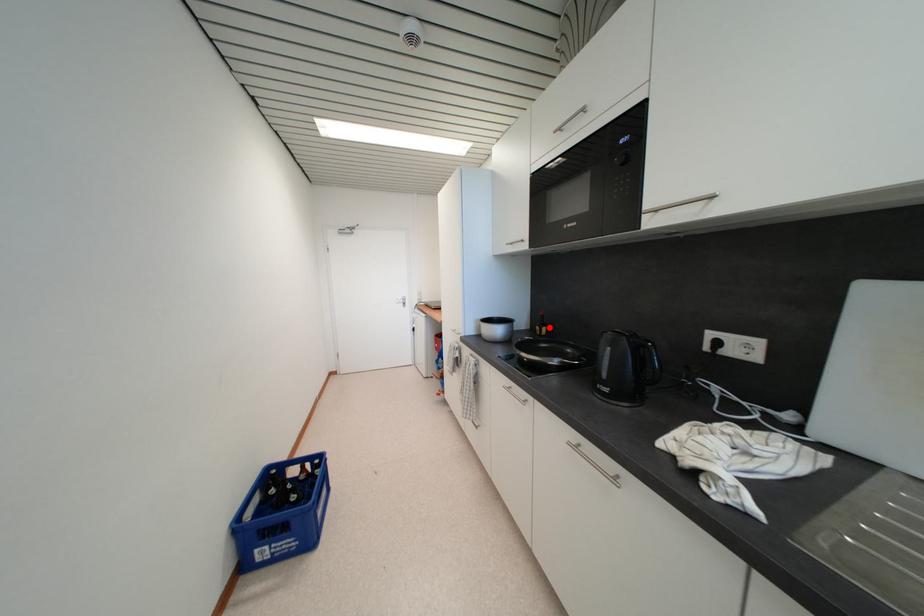
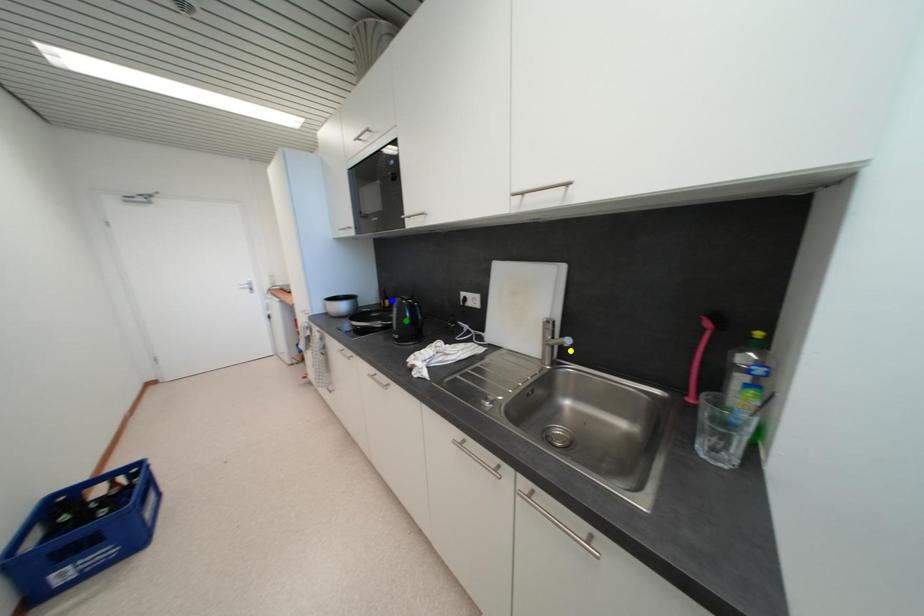
Question: I am providing you with two images of the same scene from different viewpoints. A red point is marked on the first image. You are given multiple points on the second image. In image 2, which mark is for the same physical point as the one in image 1?

Choices:
 (A) yellow point
 (B) blue point
 (C) green point

Answer: (B)